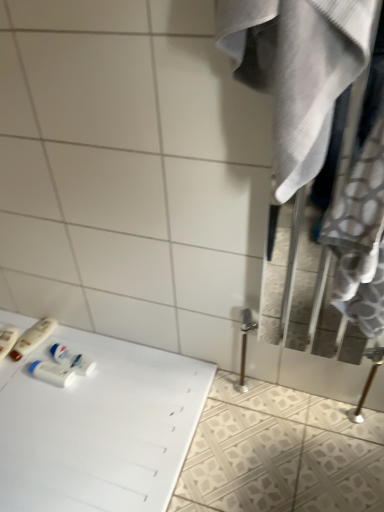
Question: Can you confirm if white plastic mouthwash at lower left is smaller than matte plastic toothbrush at lower left, the first toiletry in the left-to-right sequence?

Choices:
 (A) no
 (B) yes

Answer: (B)

Question: Is white plastic mouthwash at lower left outside matte plastic toothbrush at lower left, the first toiletry in the left-to-right sequence?

Choices:
 (A) no
 (B) yes

Answer: (B)

Question: Does white plastic mouthwash at lower left have a greater width compared to matte plastic toothbrush at lower left, acting as the 3th toiletry starting from the right?

Choices:
 (A) no
 (B) yes

Answer: (A)

Question: From a real-world perspective, is white plastic mouthwash at lower left positioned over matte plastic toothbrush at lower left, the first toiletry in the left-to-right sequence, based on gravity?

Choices:
 (A) yes
 (B) no

Answer: (A)

Question: From a real-world perspective, is white plastic mouthwash at lower left located beneath matte plastic toothbrush at lower left, the first toiletry in the left-to-right sequence?

Choices:
 (A) no
 (B) yes

Answer: (A)

Question: Is white plastic mouthwash at lower left turned away from matte plastic toothbrush at lower left, the first toiletry in the left-to-right sequence?

Choices:
 (A) no
 (B) yes

Answer: (A)

Question: From the image's perspective, does white plastic bottles at lower left, which ranks as the second toiletry in right-to-left order, appear lower than matte plastic toothbrush at lower left, acting as the 3th toiletry starting from the right?

Choices:
 (A) yes
 (B) no

Answer: (B)

Question: Is white plastic bottles at lower left, which is the 2th toiletry from left to right, turned away from matte plastic toothbrush at lower left, the first toiletry in the left-to-right sequence?

Choices:
 (A) yes
 (B) no

Answer: (B)

Question: Does white plastic bottles at lower left, which ranks as the second toiletry in right-to-left order, have a greater width compared to matte plastic toothbrush at lower left, the first toiletry in the left-to-right sequence?

Choices:
 (A) no
 (B) yes

Answer: (B)

Question: Does white plastic bottles at lower left, which ranks as the second toiletry in right-to-left order, appear on the left side of matte plastic toothbrush at lower left, the first toiletry in the left-to-right sequence?

Choices:
 (A) no
 (B) yes

Answer: (A)

Question: Is the position of white plastic bottles at lower left, which is the 2th toiletry from left to right, less distant than that of matte plastic toothbrush at lower left, the first toiletry in the left-to-right sequence?

Choices:
 (A) no
 (B) yes

Answer: (A)

Question: Does white plastic bottles at lower left, which is the 2th toiletry from left to right, lie behind matte plastic toothbrush at lower left, acting as the 3th toiletry starting from the right?

Choices:
 (A) yes
 (B) no

Answer: (A)

Question: Is white glossy table at lower left positioned far away from white fabric closet at right?

Choices:
 (A) yes
 (B) no

Answer: (B)